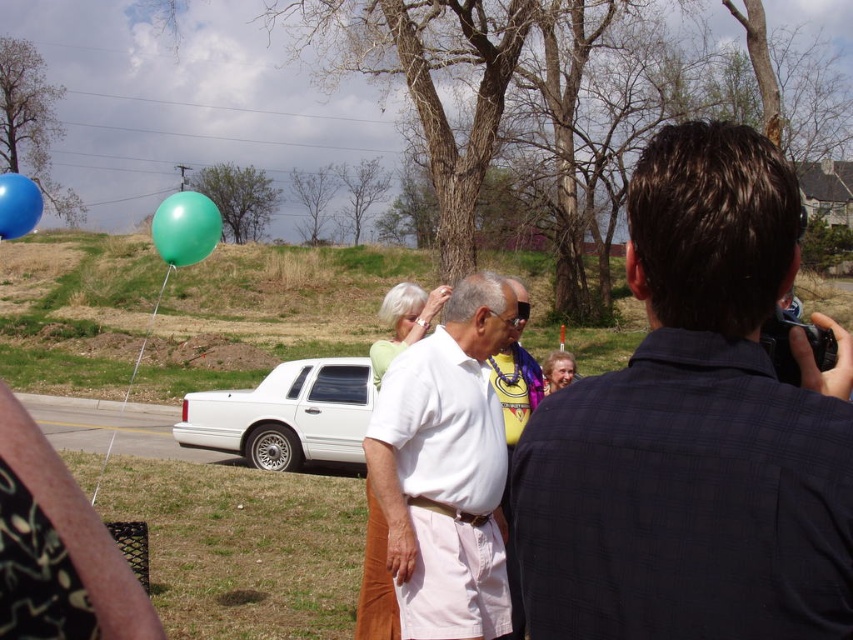
Question: Estimate the real-world distances between objects in this image. Which object is closer to the white glossy sedan at center?

Choices:
 (A) white cotton shirt at center
 (B) shiny blue balloon at upper left

Answer: (B)

Question: Which point is closer to the camera?

Choices:
 (A) (294, 445)
 (B) (213, 214)
 (C) (15, 218)
 (D) (685, 246)

Answer: (D)

Question: Does dark blue shirt at center have a smaller size compared to white glossy sedan at center?

Choices:
 (A) yes
 (B) no

Answer: (A)

Question: Which is nearer to the white glossy sedan at center?

Choices:
 (A) green rubber balloon at upper left
 (B) shiny blue balloon at upper left
 (C) white cotton shirt at center
 (D) dark blue shirt at center

Answer: (A)

Question: Is white cotton shirt at center behind shiny blue balloon at upper left?

Choices:
 (A) yes
 (B) no

Answer: (B)

Question: Does white cotton shirt at center have a larger size compared to green rubber balloon at upper left?

Choices:
 (A) no
 (B) yes

Answer: (A)